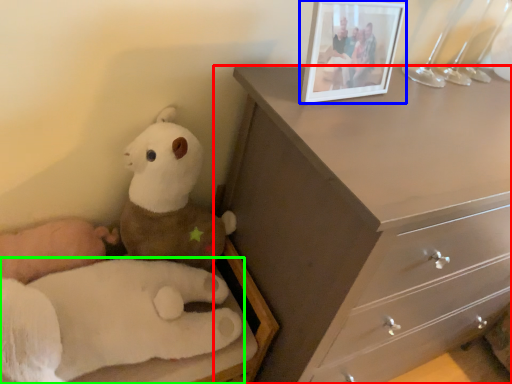
Question: Which object is positioned closest to chest of drawers (highlighted by a red box)? Select from picture frame (highlighted by a blue box) and toy (highlighted by a green box).

Choices:
 (A) picture frame
 (B) toy

Answer: (A)